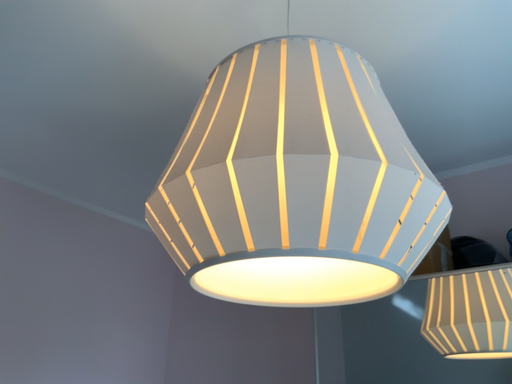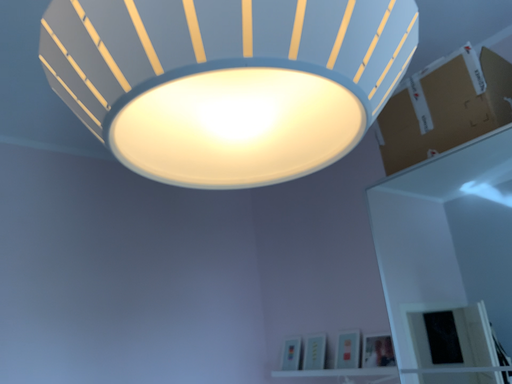
Question: Which way did the camera rotate in the video?

Choices:
 (A) rotated left
 (B) rotated right

Answer: (A)